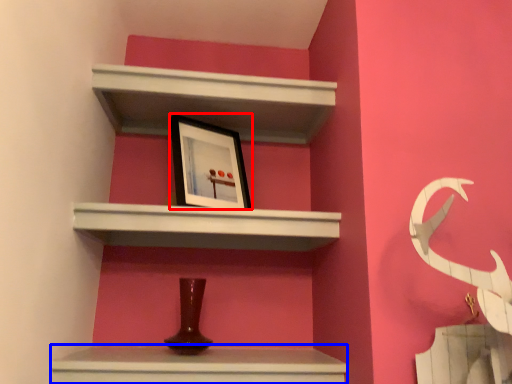
Question: Which point is further to the camera, picture frame (highlighted by a red box) or vanity (highlighted by a blue box)?

Choices:
 (A) picture frame
 (B) vanity

Answer: (A)